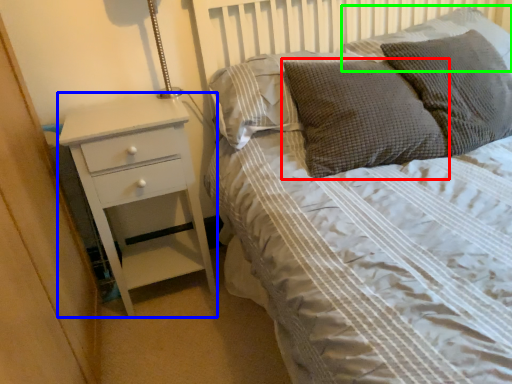
Question: Based on their relative distances, which object is farther from pillow (highlighted by a red box)? Choose from chest of drawers (highlighted by a blue box) and pillow (highlighted by a green box).

Choices:
 (A) chest of drawers
 (B) pillow

Answer: (A)